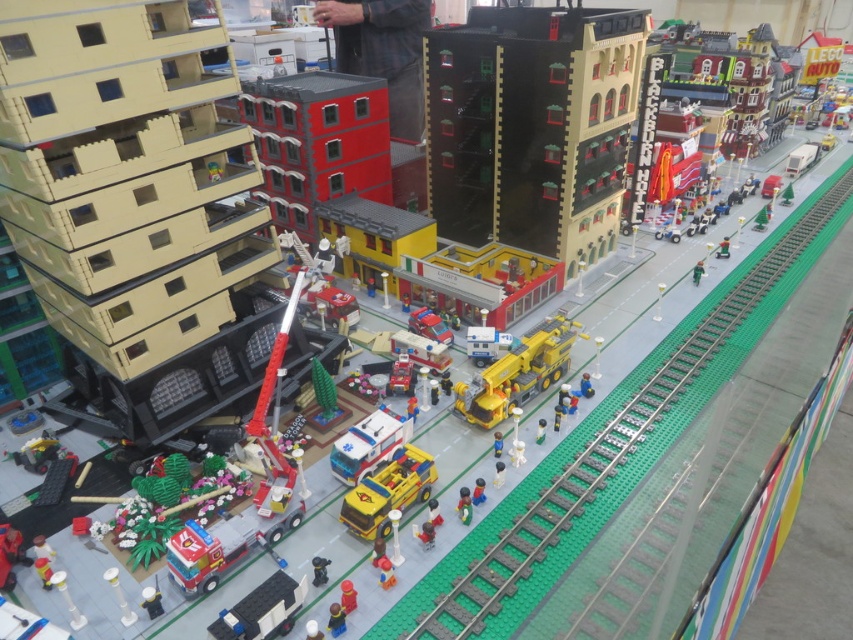
You are a delivery drone that needs to fly over the yellow matte ambulance at center and the white plastic bus at lower center. Since the drone has a minimum flight height requirement, which object do you need to be cautious of due to its height?

The yellow matte ambulance at center is taller than the white plastic bus at lower center, so the drone needs to be cautious of the yellow matte ambulance at center to ensure it maintains the required flight height.

You are a Lego city planner who needs to place a new bench between the smooth plastic figure at lower center and the green matte figure at lower right. Based on their current positions, which side of the bench should face towards the beige building on the left?

The bench should face towards the beige building on the left because the smooth plastic figure at lower center is positioned on the left side of the green matte figure at lower right, meaning the beige building is to their left. Placing the bench facing that direction would align it with the existing layout.

Based on the Lego cityscape scene, where the light blue plastic person at center and the green matte figure at lower right are present, which figure is located above the other?

The green matte figure at lower right is above the light blue plastic person at center because the light blue plastic person at center is positioned under the green matte figure at lower right.